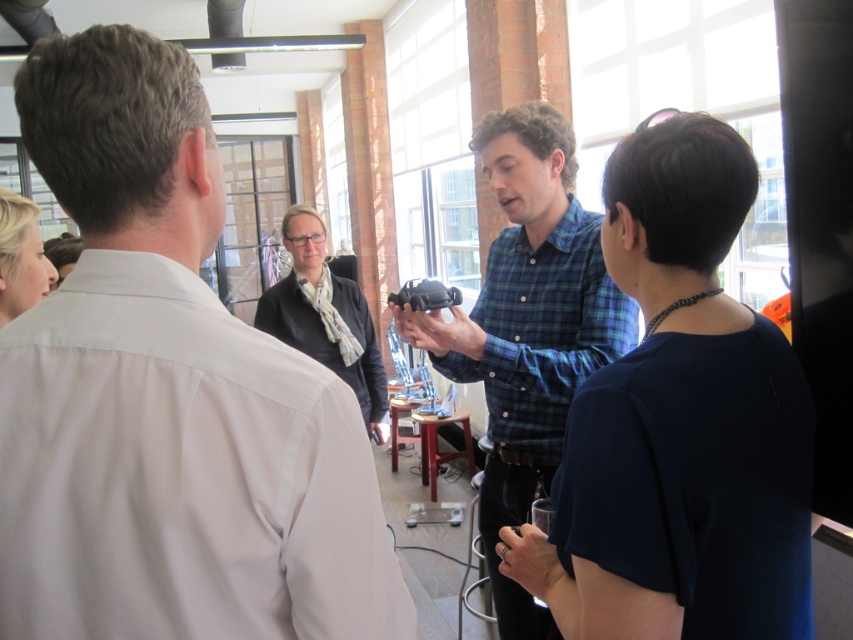
Question: Is dark blue fabric shirt at center positioned before blonde hair at upper left?

Choices:
 (A) no
 (B) yes

Answer: (B)

Question: Which point is closer to the camera?

Choices:
 (A) dark blue fabric shirt at center
 (B) white shirt at left
 (C) dark gray sweater at center
 (D) blonde hair at upper left

Answer: (B)

Question: Based on their relative distances, which object is farther from the dark gray sweater at center?

Choices:
 (A) dark blue fabric shirt at center
 (B) blonde hair at upper left
 (C) blue plaid shirt at center

Answer: (A)

Question: Is blue plaid shirt at center closer to camera compared to dark gray sweater at center?

Choices:
 (A) no
 (B) yes

Answer: (B)

Question: Estimate the real-world distances between objects in this image. Which object is farther from the blue plaid shirt at center?

Choices:
 (A) dark blue fabric shirt at center
 (B) white shirt at left
 (C) dark gray sweater at center

Answer: (C)

Question: Can you confirm if dark blue fabric shirt at center is wider than blue plaid shirt at center?

Choices:
 (A) no
 (B) yes

Answer: (A)